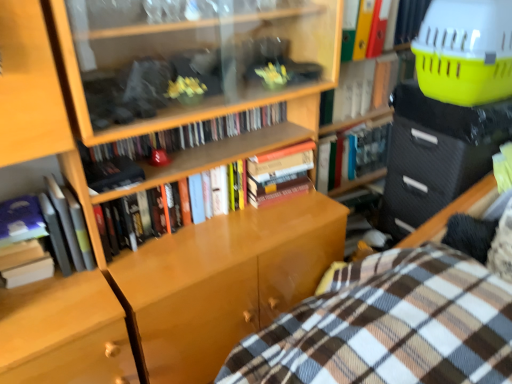
Identify the location of empty space that is ontop of hardcover book at left, the eighth book from the right (from a real-world perspective). (17, 222).